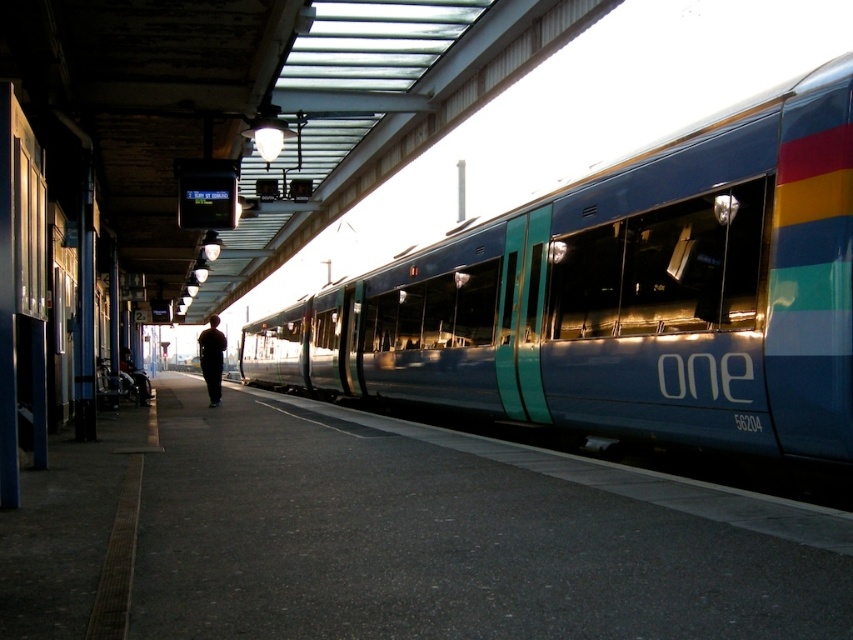
Which of these two, metallic blue train at center or dark blue wheelchair at lower left, stands taller?

Standing taller between the two is metallic blue train at center.

Is metallic blue train at center taller than dark blue wheelchair at lower left?

Indeed, metallic blue train at center has a greater height compared to dark blue wheelchair at lower left.

Is point (724, 433) positioned after point (138, 401)?

That is False.

At what (x,y) coordinates should I click in order to perform the action: click on metallic blue train at center. Please return your answer as a coordinate pair (x, y). Looking at the image, I should click on (624, 296).

Is point (207, 349) positioned behind point (144, 396)?

No.

Does dark fabric shirt at center have a lesser width compared to dark blue wheelchair at lower left?

No.

Locate an element on the screen. The width and height of the screenshot is (853, 640). dark fabric shirt at center is located at coordinates point(212,358).

Identify the location of dark fabric shirt at center. (212, 358).

Is metallic blue train at center smaller than dark fabric shirt at center?

Yes.

Which is behind, point (734, 436) or point (213, 404)?

The point (213, 404) is more distant.

The height and width of the screenshot is (640, 853). I want to click on metallic blue train at center, so click(624, 296).